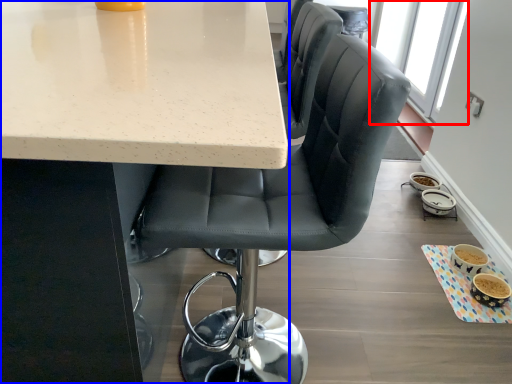
Question: Which object is closer to the camera taking this photo, window screen (highlighted by a red box) or table (highlighted by a blue box)?

Choices:
 (A) window screen
 (B) table

Answer: (B)